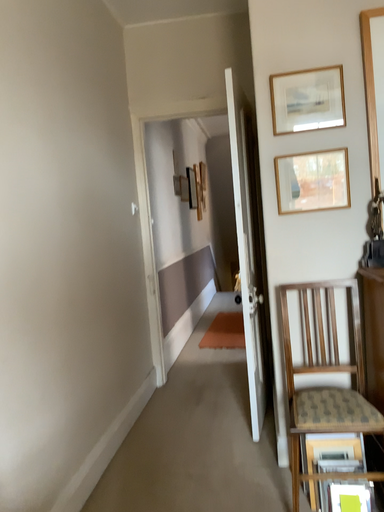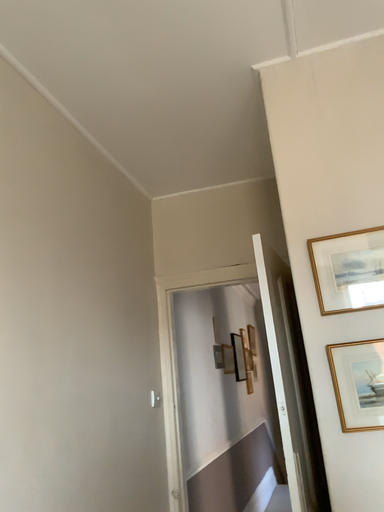
Question: How did the camera likely rotate when shooting the video?

Choices:
 (A) rotated upward
 (B) rotated downward

Answer: (A)